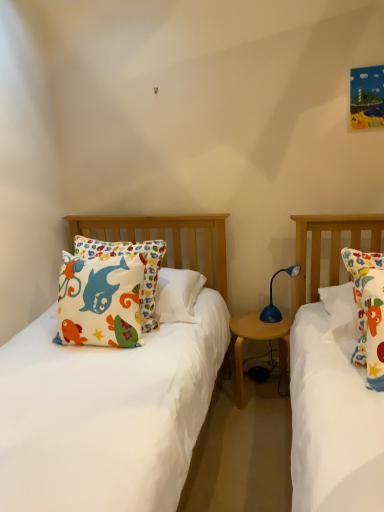
Question: From the image's perspective, is blue plastic lamp at center beneath wooden round table at center?

Choices:
 (A) no
 (B) yes

Answer: (A)

Question: From a real-world perspective, is blue plastic lamp at center positioned over wooden round table at center based on gravity?

Choices:
 (A) no
 (B) yes

Answer: (B)

Question: Can you confirm if blue plastic lamp at center is wider than wooden round table at center?

Choices:
 (A) no
 (B) yes

Answer: (A)

Question: Can you confirm if blue plastic lamp at center is smaller than wooden round table at center?

Choices:
 (A) no
 (B) yes

Answer: (B)

Question: From a real-world perspective, does blue plastic lamp at center sit lower than wooden round table at center?

Choices:
 (A) no
 (B) yes

Answer: (A)

Question: Considering the relative sizes of blue plastic lamp at center and wooden round table at center in the image provided, is blue plastic lamp at center thinner than wooden round table at center?

Choices:
 (A) no
 (B) yes

Answer: (B)

Question: Is blue plastic lamp at center at the back of wooden round table at center?

Choices:
 (A) yes
 (B) no

Answer: (B)

Question: Is wooden round table at center wider than blue plastic lamp at center?

Choices:
 (A) no
 (B) yes

Answer: (B)

Question: Would you say blue plastic lamp at center is part of wooden round table at center's contents?

Choices:
 (A) no
 (B) yes

Answer: (A)

Question: Is wooden round table at center positioned in front of blue plastic lamp at center?

Choices:
 (A) yes
 (B) no

Answer: (B)

Question: Can you confirm if wooden round table at center is positioned to the left of blue plastic lamp at center?

Choices:
 (A) no
 (B) yes

Answer: (B)

Question: Is wooden round table at center to the right of blue plastic lamp at center from the viewer's perspective?

Choices:
 (A) yes
 (B) no

Answer: (B)

Question: From the image's perspective, is blue plastic lamp at center above or below wooden round table at center?

Choices:
 (A) above
 (B) below

Answer: (A)